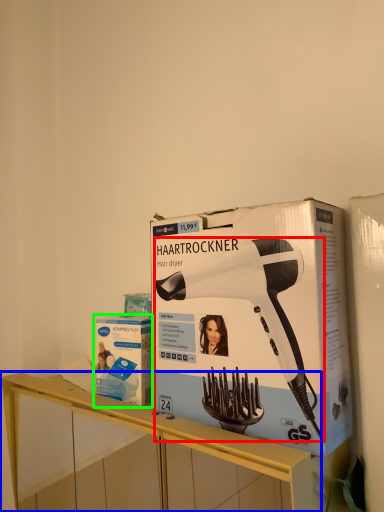
Question: Based on their relative distances, which object is farther from hair drier (highlighted by a red box)? Choose from furniture (highlighted by a blue box) and box (highlighted by a green box).

Choices:
 (A) furniture
 (B) box

Answer: (A)